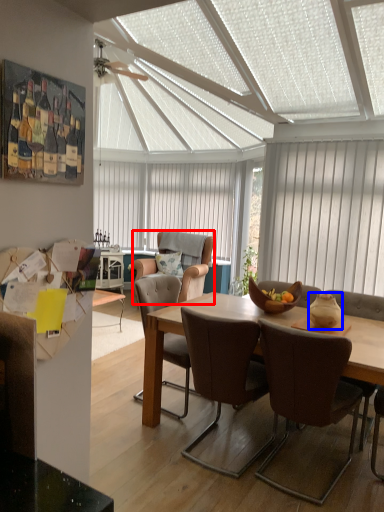
Question: Which of the following is the farthest to the observer, chair (highlighted by a red box) or vase (highlighted by a blue box)?

Choices:
 (A) chair
 (B) vase

Answer: (A)